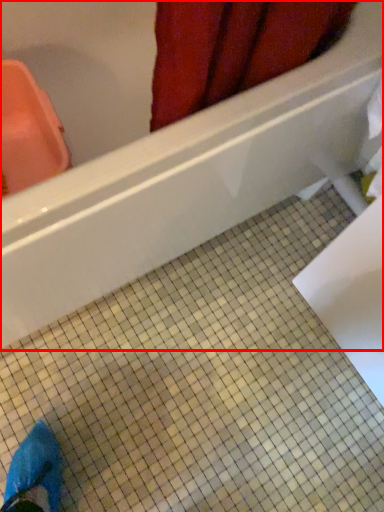
Question: From the image's perspective, what is the correct spatial positioning of bathtub (annotated by the red box) in reference to ceramic tile?

Choices:
 (A) below
 (B) above

Answer: (B)